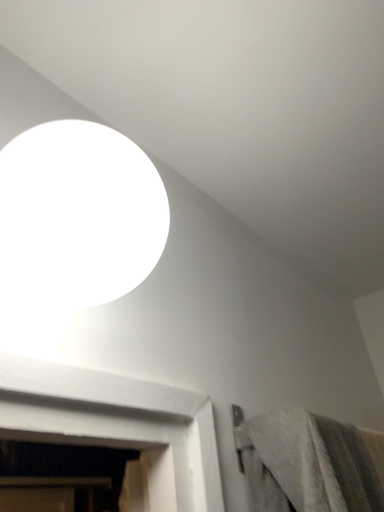
This screenshot has width=384, height=512. In order to click on white glossy sphere at upper left in this screenshot , I will do `click(74, 223)`.

This screenshot has width=384, height=512. Describe the element at coordinates (74, 223) in the screenshot. I see `white glossy sphere at upper left` at that location.

Locate an element on the screen. This screenshot has height=512, width=384. white glossy sphere at upper left is located at coordinates (74, 223).